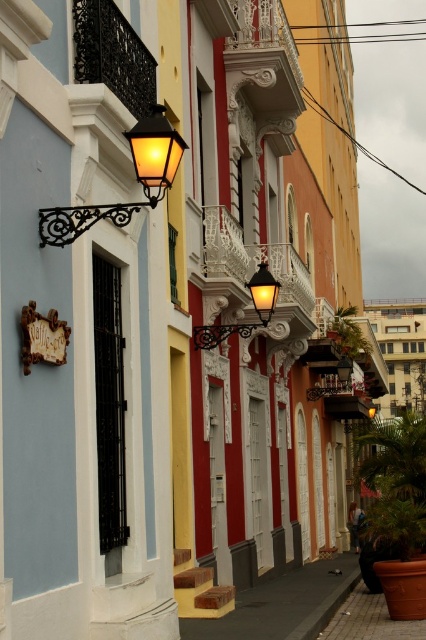
Question: Is matte black lantern at upper left wider than matte black lantern at center?

Choices:
 (A) no
 (B) yes

Answer: (A)

Question: Which object is closer to the camera taking this photo?

Choices:
 (A) matte black lantern at center
 (B) matte black lantern at upper left

Answer: (B)

Question: Is matte black lantern at upper left behind matte black lantern at center?

Choices:
 (A) no
 (B) yes

Answer: (A)

Question: Does matte black lantern at upper left appear on the left side of matte black lantern at center?

Choices:
 (A) yes
 (B) no

Answer: (A)

Question: Which of the following is the closest to the observer?

Choices:
 (A) matte black lantern at upper left
 (B) matte black lantern at center

Answer: (A)